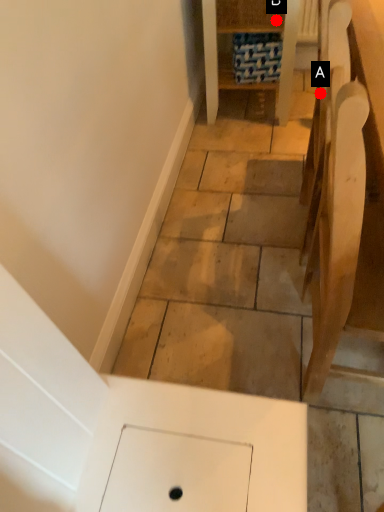
Question: Two points are circled on the image, labeled by A and B beside each circle. Among these points, which one is farthest from the camera?

Choices:
 (A) A is further
 (B) B is further

Answer: (B)